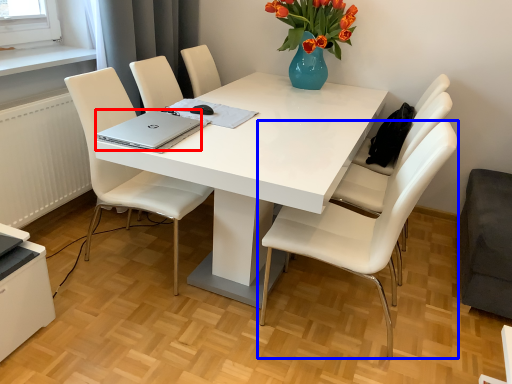
Question: Which point is further to the camera, laptop (highlighted by a red box) or chair (highlighted by a blue box)?

Choices:
 (A) laptop
 (B) chair

Answer: (A)